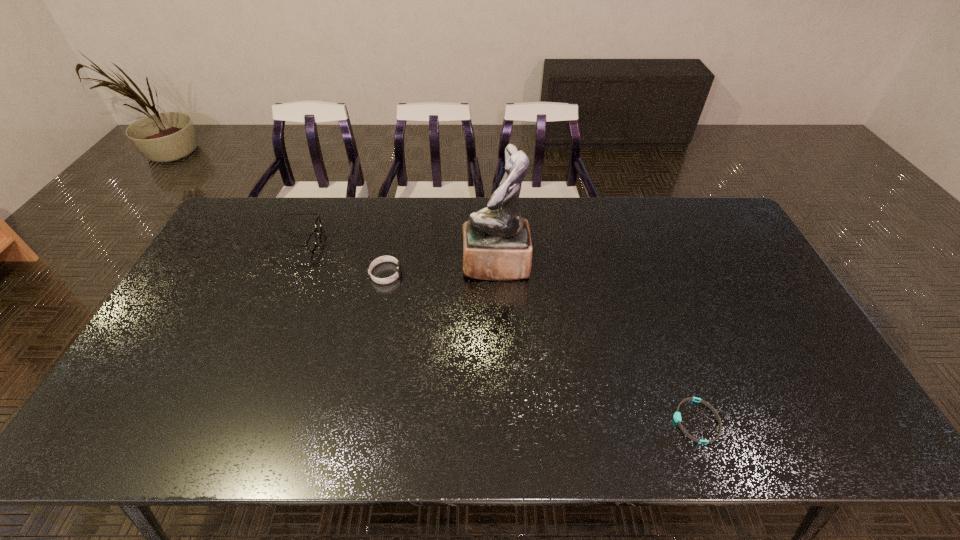
You are a GUI agent. You are given a task and a screenshot of the screen. Output one action in this format:
    pyautogui.click(x=<x>, y=<y>)
    Task: Click on the sculpture
    The image size is (960, 540).
    Given the screenshot: What is the action you would take?
    pyautogui.click(x=497, y=245)

The width and height of the screenshot is (960, 540). I want to click on the tallest object, so click(x=497, y=245).

I want to click on spectacles, so click(x=311, y=242).

Image resolution: width=960 pixels, height=540 pixels. What are the coordinates of `the second tallest object` in the screenshot? It's located at (311, 242).

I want to click on the third object from right to left, so click(381, 259).

Where is `the farther wristband`? The height and width of the screenshot is (540, 960). the farther wristband is located at coordinates (381, 259).

The image size is (960, 540). What are the coordinates of `the rightmost object` in the screenshot? It's located at (677, 415).

Identify the location of the shorter wristband. (677, 415).

Find the location of a particular element. free location located in a relaxed pose on the second object from right to left is located at coordinates (348, 264).

I want to click on vacant region located 0.300m in a relaxed pose on the second object from right to left, so click(x=369, y=264).